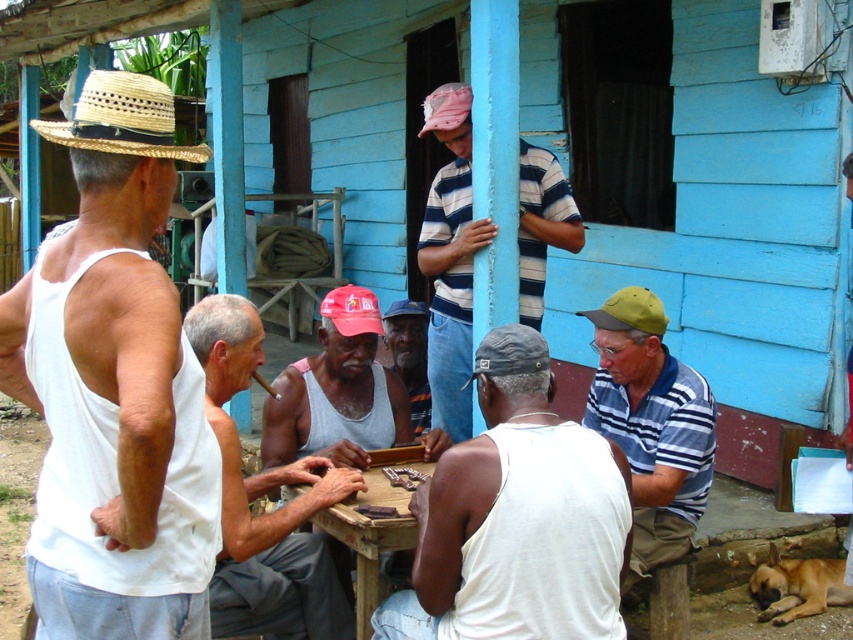
Between dark brown leather cap at center and white cotton shirt at center, which one is positioned lower?

Positioned lower is white cotton shirt at center.

Is point (416, 337) less distant than point (846, 557)?

No, (416, 337) is behind (846, 557).

Describe the element at coordinates (409, 356) in the screenshot. I see `dark brown leather cap at center` at that location.

Where is `dark brown leather cap at center`? Image resolution: width=853 pixels, height=640 pixels. dark brown leather cap at center is located at coordinates (409, 356).

Who is more distant from viewer, (x=210, y=618) or (x=653, y=316)?

The point (x=653, y=316) is more distant.

Between white tank top at center and green fabric cap at lower right, which one is positioned higher?

green fabric cap at lower right

Which is behind, point (253, 342) or point (650, 292)?

The point (650, 292) is more distant.

The width and height of the screenshot is (853, 640). Identify the location of white tank top at center. (263, 493).

Between white matte tank top at left and striped cotton shirt at center, which one has more height?

striped cotton shirt at center is taller.

Which is more to the left, white matte tank top at left or striped cotton shirt at center?

white matte tank top at left

In order to click on white matte tank top at left in this screenshot , I will do `click(114, 387)`.